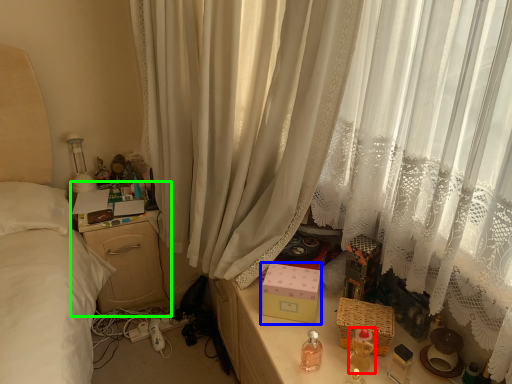
Question: Which object is positioned farthest from baby bottle (highlighted by a red box)? Select from box (highlighted by a blue box) and nightstand (highlighted by a green box).

Choices:
 (A) box
 (B) nightstand

Answer: (B)